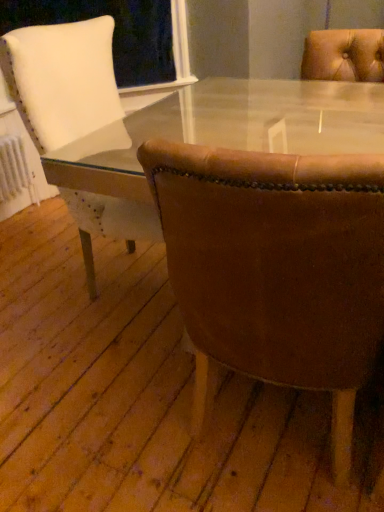
Identify the location of leather at right, which is the first chair from left to right. Image resolution: width=384 pixels, height=512 pixels. (62, 80).

What do you see at coordinates (62, 80) in the screenshot? I see `leather at right, the second chair viewed from the right` at bounding box center [62, 80].

This screenshot has height=512, width=384. What do you see at coordinates (276, 267) in the screenshot? I see `brown leather chair at center, marked as the 1th chair in a right-to-left arrangement` at bounding box center [276, 267].

Measure the distance between point (294,186) and camera.

Point (294,186) and camera are 23.62 inches apart from each other.

What are the coordinates of `brown leather chair at center, which ranks as the second chair in left-to-right order` in the screenshot? It's located at (276, 267).

The image size is (384, 512). I want to click on leather at right, the second chair viewed from the right, so click(62, 80).

Consider the image. Which object is positioned more to the left, leather at right, the second chair viewed from the right, or brown leather chair at center, marked as the 1th chair in a right-to-left arrangement?

leather at right, the second chair viewed from the right, is more to the left.

Does leather at right, which is the first chair from left to right, lie in front of brown leather chair at center, which ranks as the second chair in left-to-right order?

No, leather at right, which is the first chair from left to right, is further to the viewer.

Is point (44, 149) farther from viewer compared to point (359, 325)?

That is True.

From the image's perspective, does leather at right, which is the first chair from left to right, appear lower than brown leather chair at center, marked as the 1th chair in a right-to-left arrangement?

Actually, leather at right, which is the first chair from left to right, appears above brown leather chair at center, marked as the 1th chair in a right-to-left arrangement, in the image.

From a real-world perspective, which object rests below the other?

brown leather chair at center, which ranks as the second chair in left-to-right order.

Does leather at right, the second chair viewed from the right, have a lesser width compared to brown leather chair at center, which ranks as the second chair in left-to-right order?

No, leather at right, the second chair viewed from the right, is not thinner than brown leather chair at center, which ranks as the second chair in left-to-right order.

Considering the sizes of objects leather at right, the second chair viewed from the right, and brown leather chair at center, which ranks as the second chair in left-to-right order, in the image provided, who is shorter, leather at right, the second chair viewed from the right, or brown leather chair at center, which ranks as the second chair in left-to-right order,?

brown leather chair at center, which ranks as the second chair in left-to-right order, is shorter.

Considering the relative sizes of leather at right, which is the first chair from left to right, and brown leather chair at center, which ranks as the second chair in left-to-right order, in the image provided, is leather at right, which is the first chair from left to right, bigger than brown leather chair at center, which ranks as the second chair in left-to-right order,?

Yes, leather at right, which is the first chair from left to right, is bigger than brown leather chair at center, which ranks as the second chair in left-to-right order.

Which is correct: leather at right, the second chair viewed from the right, is inside brown leather chair at center, which ranks as the second chair in left-to-right order, or outside of it?

leather at right, the second chair viewed from the right, exists outside the volume of brown leather chair at center, which ranks as the second chair in left-to-right order.

In the scene shown: Is leather at right, which is the first chair from left to right, in contact with brown leather chair at center, marked as the 1th chair in a right-to-left arrangement?

leather at right, which is the first chair from left to right, and brown leather chair at center, marked as the 1th chair in a right-to-left arrangement, are not in contact.

Is leather at right, which is the first chair from left to right, oriented towards brown leather chair at center, marked as the 1th chair in a right-to-left arrangement?

Yes, leather at right, which is the first chair from left to right, is facing brown leather chair at center, marked as the 1th chair in a right-to-left arrangement.

How different are the orientations of leather at right, the second chair viewed from the right, and brown leather chair at center, marked as the 1th chair in a right-to-left arrangement, in degrees?

The angle between the facing direction of leather at right, the second chair viewed from the right, and the facing direction of brown leather chair at center, marked as the 1th chair in a right-to-left arrangement, is 90.8 degrees.

Measure the distance between leather at right, which is the first chair from left to right, and brown leather chair at center, which ranks as the second chair in left-to-right order.

leather at right, which is the first chair from left to right, and brown leather chair at center, which ranks as the second chair in left-to-right order, are 72.21 centimeters apart.

Identify the location of chair on the right of the leather at right, which is the first chair from left to right. The width and height of the screenshot is (384, 512). (276, 267).

Does brown leather chair at center, which ranks as the second chair in left-to-right order, appear on the right side of leather at right, which is the first chair from left to right?

Indeed, brown leather chair at center, which ranks as the second chair in left-to-right order, is positioned on the right side of leather at right, which is the first chair from left to right.

Which is in front, brown leather chair at center, marked as the 1th chair in a right-to-left arrangement, or leather at right, which is the first chair from left to right?

brown leather chair at center, marked as the 1th chair in a right-to-left arrangement, is in front.

Considering the positions of points (244, 367) and (65, 92), is point (244, 367) closer to camera compared to point (65, 92)?

Yes.

From the image's perspective, which object appears higher, brown leather chair at center, marked as the 1th chair in a right-to-left arrangement, or leather at right, the second chair viewed from the right?

leather at right, the second chair viewed from the right, from the image's perspective.

From a real-world perspective, who is located higher, brown leather chair at center, which ranks as the second chair in left-to-right order, or leather at right, the second chair viewed from the right?

leather at right, the second chair viewed from the right, from a real-world perspective.

Considering the sizes of objects brown leather chair at center, marked as the 1th chair in a right-to-left arrangement, and leather at right, which is the first chair from left to right, in the image provided, who is wider, brown leather chair at center, marked as the 1th chair in a right-to-left arrangement, or leather at right, which is the first chair from left to right,?

leather at right, which is the first chair from left to right, is wider.

Considering the relative sizes of brown leather chair at center, which ranks as the second chair in left-to-right order, and leather at right, which is the first chair from left to right, in the image provided, is brown leather chair at center, which ranks as the second chair in left-to-right order, taller than leather at right, which is the first chair from left to right,?

In fact, brown leather chair at center, which ranks as the second chair in left-to-right order, may be shorter than leather at right, which is the first chair from left to right.

Considering the sizes of objects brown leather chair at center, marked as the 1th chair in a right-to-left arrangement, and leather at right, the second chair viewed from the right, in the image provided, who is bigger, brown leather chair at center, marked as the 1th chair in a right-to-left arrangement, or leather at right, the second chair viewed from the right,?

leather at right, the second chair viewed from the right, is bigger.

Is brown leather chair at center, which ranks as the second chair in left-to-right order, not within leather at right, which is the first chair from left to right?

Yes.

Is brown leather chair at center, which ranks as the second chair in left-to-right order, in contact with leather at right, the second chair viewed from the right?

brown leather chair at center, which ranks as the second chair in left-to-right order, is not next to leather at right, the second chair viewed from the right, and they're not touching.

Is brown leather chair at center, which ranks as the second chair in left-to-right order, positioned with its back to leather at right, the second chair viewed from the right?

That's not correct — brown leather chair at center, which ranks as the second chair in left-to-right order, is not looking away from leather at right, the second chair viewed from the right.

Image resolution: width=384 pixels, height=512 pixels. In the image, there is a leather at right, the second chair viewed from the right. Find the location of `chair below it (from a real-world perspective)`. chair below it (from a real-world perspective) is located at coordinates (276, 267).

In order to click on chair in front of the leather at right, the second chair viewed from the right in this screenshot , I will do pyautogui.click(x=276, y=267).

The height and width of the screenshot is (512, 384). Identify the location of chair above the brown leather chair at center, marked as the 1th chair in a right-to-left arrangement (from the image's perspective). (62, 80).